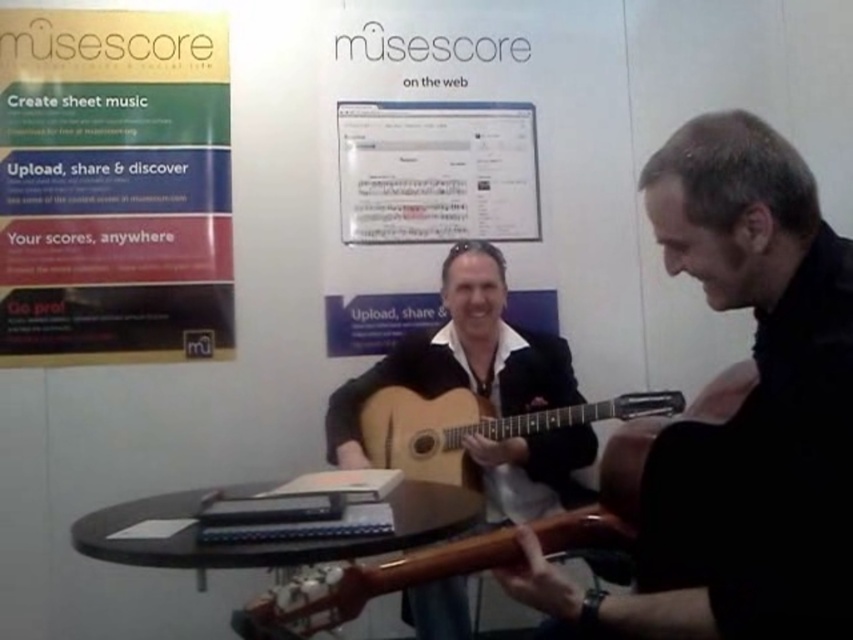
Question: Is matte black guitar at center above white paper at center?

Choices:
 (A) yes
 (B) no

Answer: (B)

Question: Which is nearer to the white paper at center?

Choices:
 (A) matte black guitar at center
 (B) matte gold poster at upper left
 (C) light brown wood guitar at center

Answer: (C)

Question: Is matte gold poster at upper left closer to camera compared to white paper at center?

Choices:
 (A) no
 (B) yes

Answer: (B)

Question: Which point is closer to the camera?

Choices:
 (A) light brown wood guitar at center
 (B) matte gold poster at upper left
 (C) glossy wood guitar at center
 (D) white paper at center

Answer: (C)

Question: Among these points, which one is nearest to the camera?

Choices:
 (A) (386, 380)
 (B) (173, 38)
 (C) (561, 513)
 (D) (421, 148)

Answer: (C)

Question: Is matte gold poster at upper left closer to camera compared to glossy wood guitar at center?

Choices:
 (A) no
 (B) yes

Answer: (A)